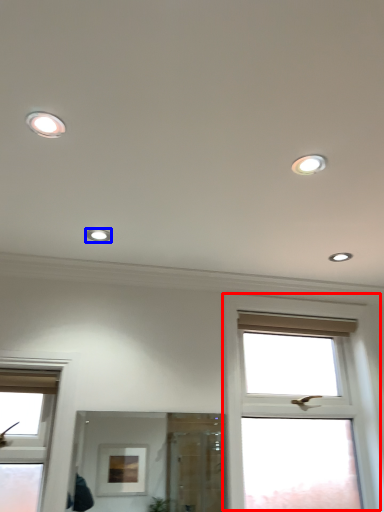
Question: Which of the following is the closest to the observer, window (highlighted by a red box) or dot (highlighted by a blue box)?

Choices:
 (A) window
 (B) dot

Answer: (B)